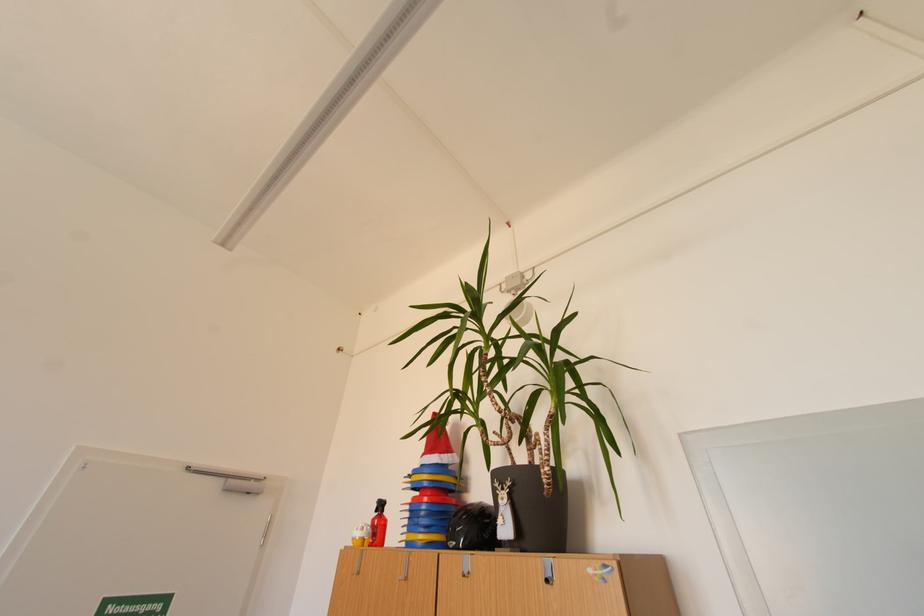
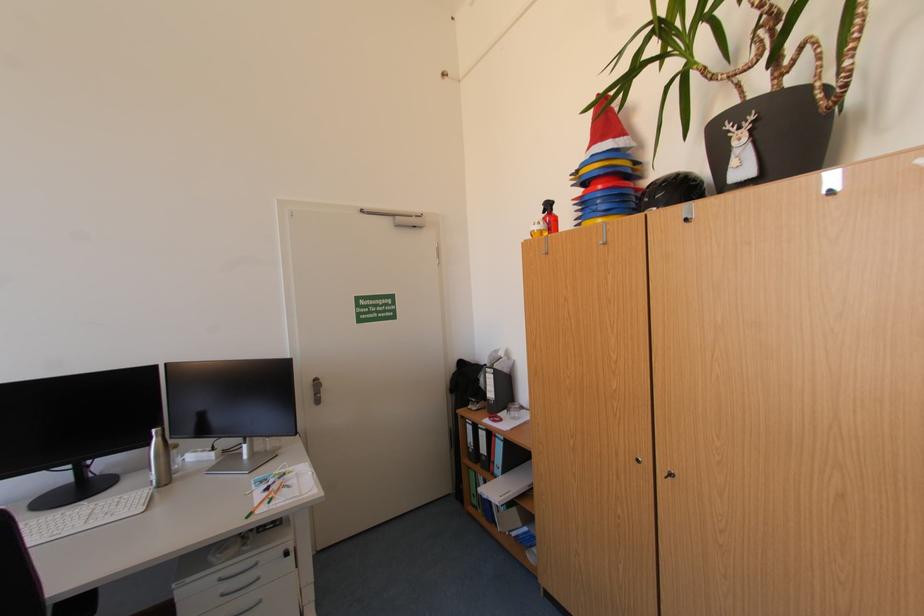
Find the pixel in the second image that matches the point at 431,514 in the first image.

(606, 203)